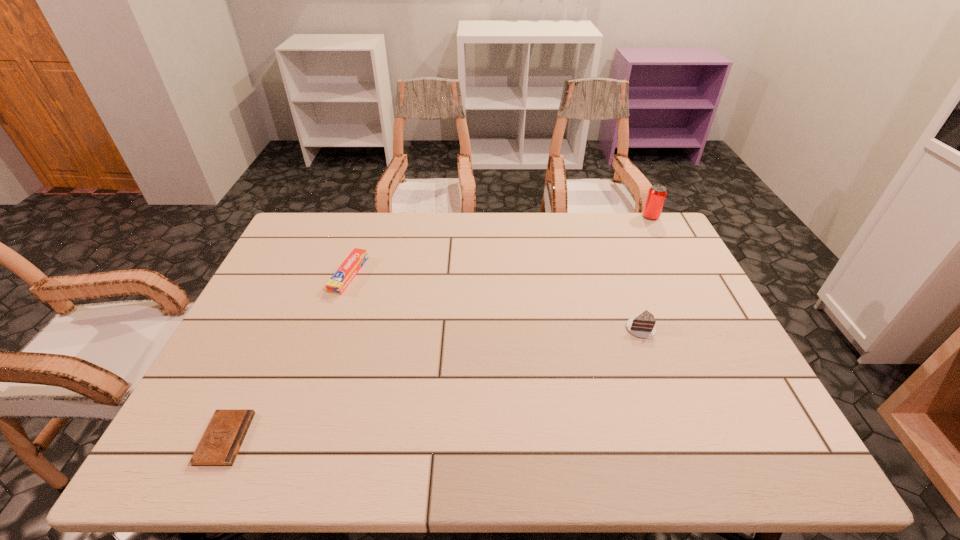
Identify the location of the rightmost object. (657, 193).

Image resolution: width=960 pixels, height=540 pixels. I want to click on can, so click(657, 193).

The image size is (960, 540). What are the coordinates of `the third farthest object` in the screenshot? It's located at (643, 326).

Image resolution: width=960 pixels, height=540 pixels. What are the coordinates of `the third object from left to right` in the screenshot? It's located at (643, 326).

What are the coordinates of `the third nearest object` in the screenshot? It's located at (337, 284).

Locate an element on the screen. The height and width of the screenshot is (540, 960). toothpaste is located at coordinates (337, 284).

This screenshot has width=960, height=540. Identify the location of the shortest object. (223, 437).

Find the location of a particular element. diary is located at coordinates (223, 437).

This screenshot has width=960, height=540. What are the coordinates of `blank space located 0.300m on the left of the farthest object` in the screenshot? It's located at (558, 217).

This screenshot has width=960, height=540. I want to click on free location located 0.380m on the left of the chocolate cake, so click(x=483, y=330).